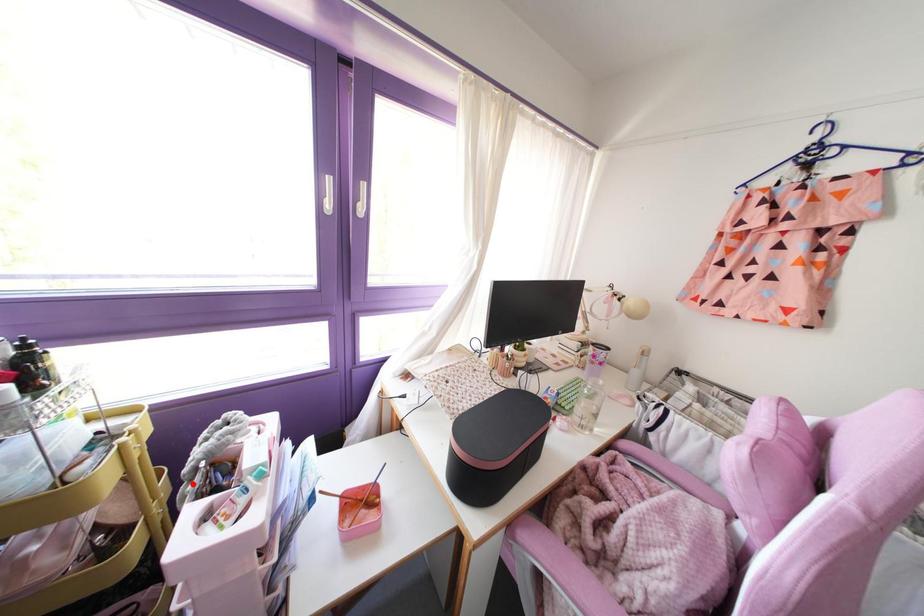
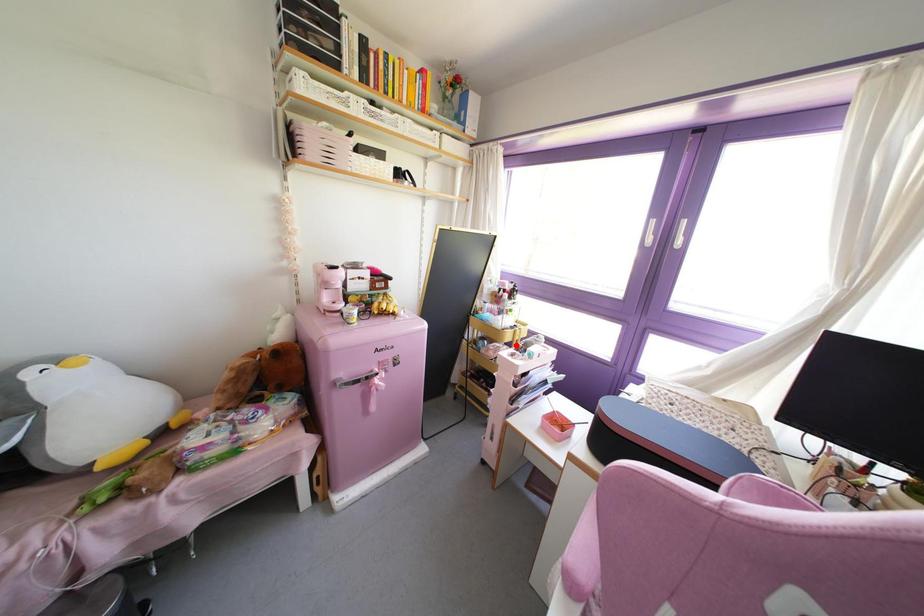
I am providing you with two images of the same scene from different viewpoints. A red point is marked on the first image and another point is marked on the second image. Is the red point in image1 aligned with the point shown in image2?

Yes